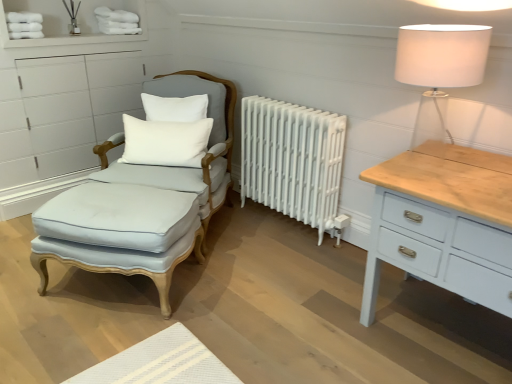
Locate an element on the screen. This screenshot has width=512, height=384. free space in front of light blue fabric swivel chair at left is located at coordinates (182, 294).